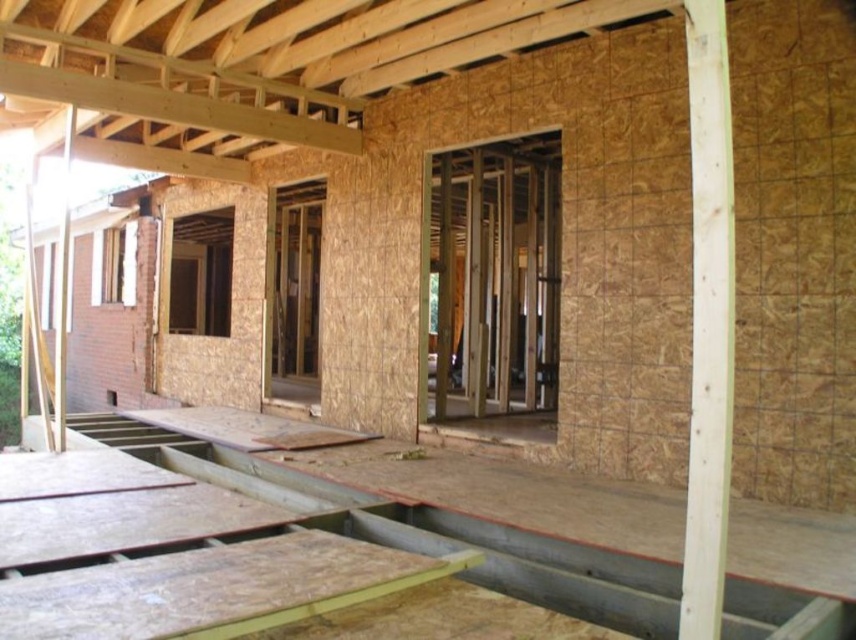
You are a contractor assessing the construction site. You see the wooden floorboards at center and the light brown wood at right. Which object is shorter in height?

The wooden floorboards at center is shorter in height than the light brown wood at right.

You are a construction worker standing at the entrance of the house under construction. You see the wooden floorboards at center and the light brown wood at right. Which one is closer to the ground?

The wooden floorboards at center is below light brown wood at right, so the wooden floorboards at center is closer to the ground.